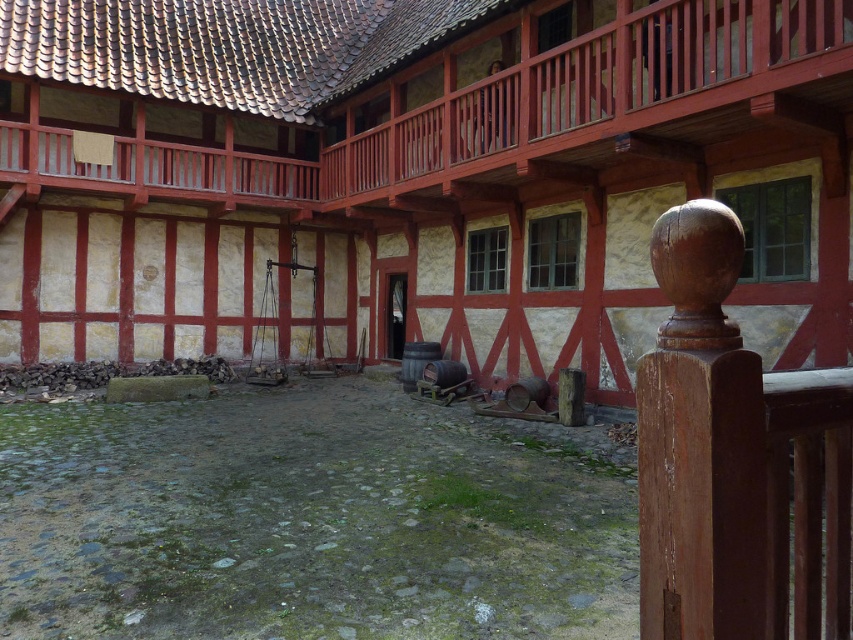
Question: Does wooden balcony at upper center appear under wooden post at lower right?

Choices:
 (A) yes
 (B) no

Answer: (B)

Question: Which point is closer to the camera?

Choices:
 (A) (518, 128)
 (B) (639, 536)

Answer: (B)

Question: Is wooden balcony at upper center further to camera compared to wooden post at lower right?

Choices:
 (A) no
 (B) yes

Answer: (B)

Question: Does wooden balcony at upper center appear on the left side of wooden post at lower right?

Choices:
 (A) yes
 (B) no

Answer: (A)